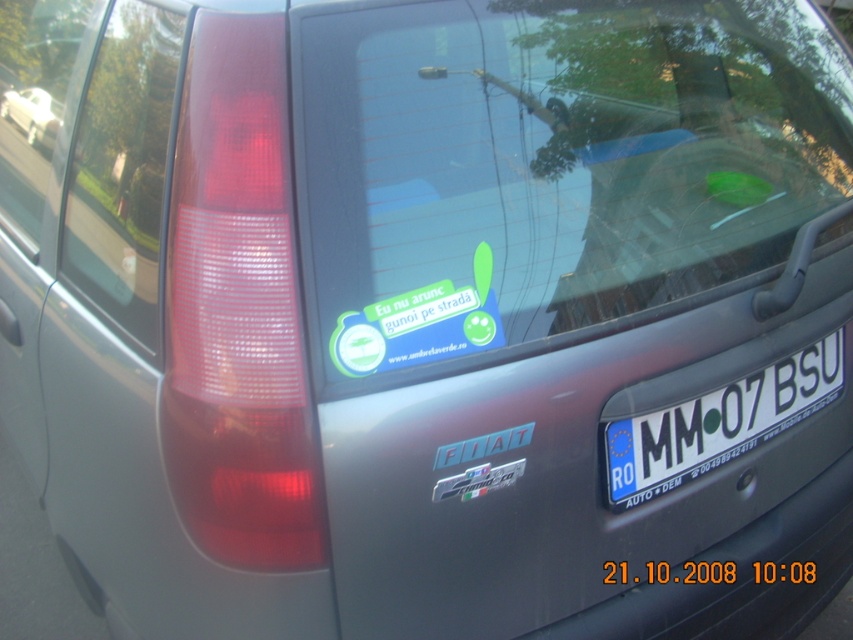
Can you confirm if transparent glass windshield at upper center is positioned to the right of white plastic license plate at center?

In fact, transparent glass windshield at upper center is to the left of white plastic license plate at center.

In the scene shown: Is transparent glass windshield at upper center wider than white plastic license plate at center?

Indeed, transparent glass windshield at upper center has a greater width compared to white plastic license plate at center.

Who is more forward, (718, 209) or (689, 472)?

Point (689, 472) is more forward.

This screenshot has height=640, width=853. I want to click on transparent glass windshield at upper center, so click(550, 166).

Is white plastic license plate at center to the left of white glossy sedan at upper left from the viewer's perspective?

Incorrect, white plastic license plate at center is not on the left side of white glossy sedan at upper left.

Is white plastic license plate at center shorter than white glossy sedan at upper left?

In fact, white plastic license plate at center may be taller than white glossy sedan at upper left.

Image resolution: width=853 pixels, height=640 pixels. What do you see at coordinates (718, 422) in the screenshot?
I see `white plastic license plate at center` at bounding box center [718, 422].

Locate an element on the screen. This screenshot has width=853, height=640. white plastic license plate at center is located at coordinates (718, 422).

The width and height of the screenshot is (853, 640). Describe the element at coordinates (123, 168) in the screenshot. I see `transparent glass at right` at that location.

Does transparent glass at right have a lesser width compared to white plastic license plate at center?

Yes.

The image size is (853, 640). What do you see at coordinates (123, 168) in the screenshot?
I see `transparent glass at right` at bounding box center [123, 168].

In order to click on transparent glass at right in this screenshot , I will do `click(123, 168)`.